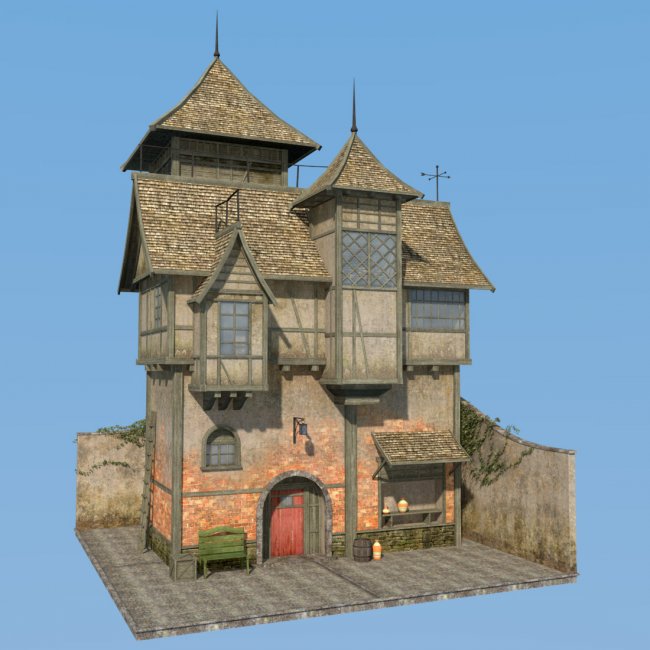
At what (x,y) coordinates should I click in order to perform the action: click on floor. Please return your answer as a coordinate pair (x, y). This screenshot has width=650, height=650. Looking at the image, I should click on (470, 571).